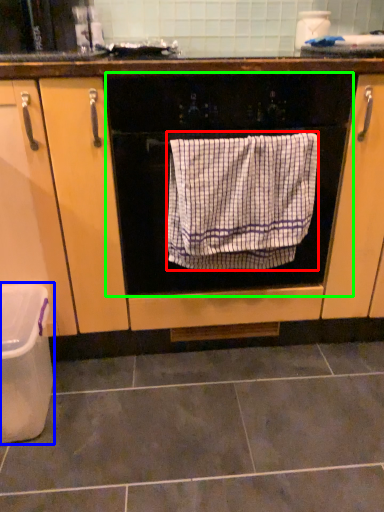
Question: Which is farther away from bath towel (highlighted by a red box)? dish washer (highlighted by a blue box) or oven (highlighted by a green box)?

Choices:
 (A) dish washer
 (B) oven

Answer: (A)